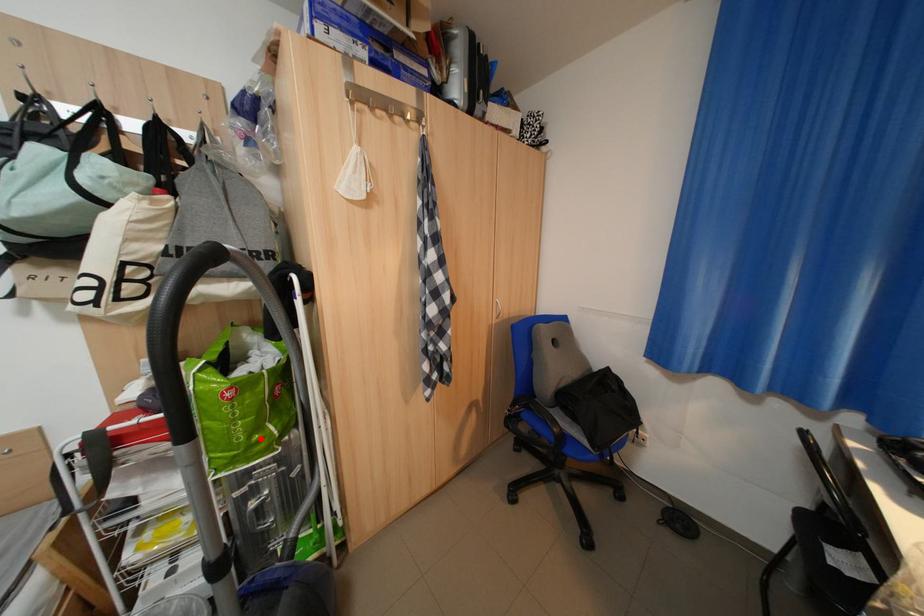
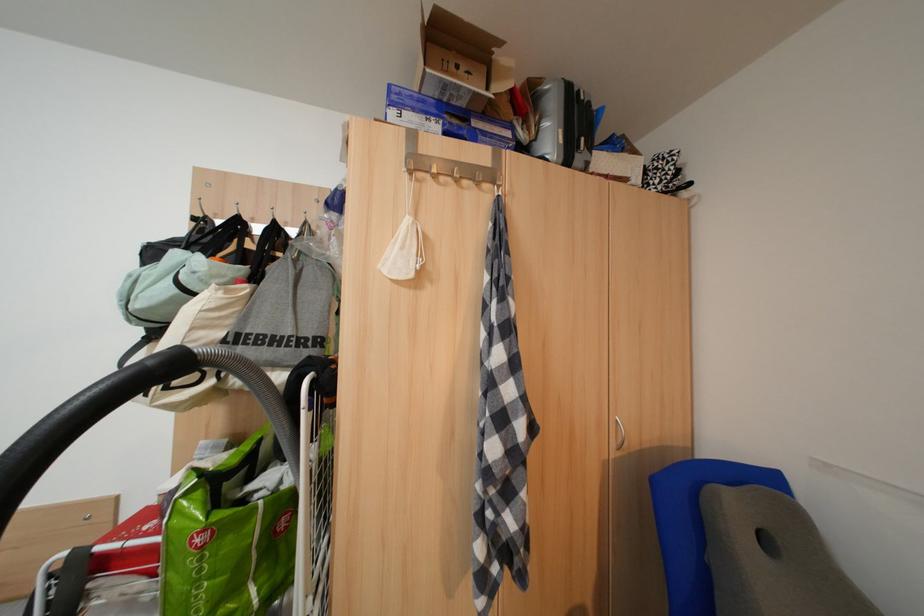
Question: I am providing you with two images of the same scene from different viewpoints. A red point is marked on the first image. At the location where the point appears in image 1, is it still visible in image 2?

Choices:
 (A) Yes
 (B) No

Answer: (A)